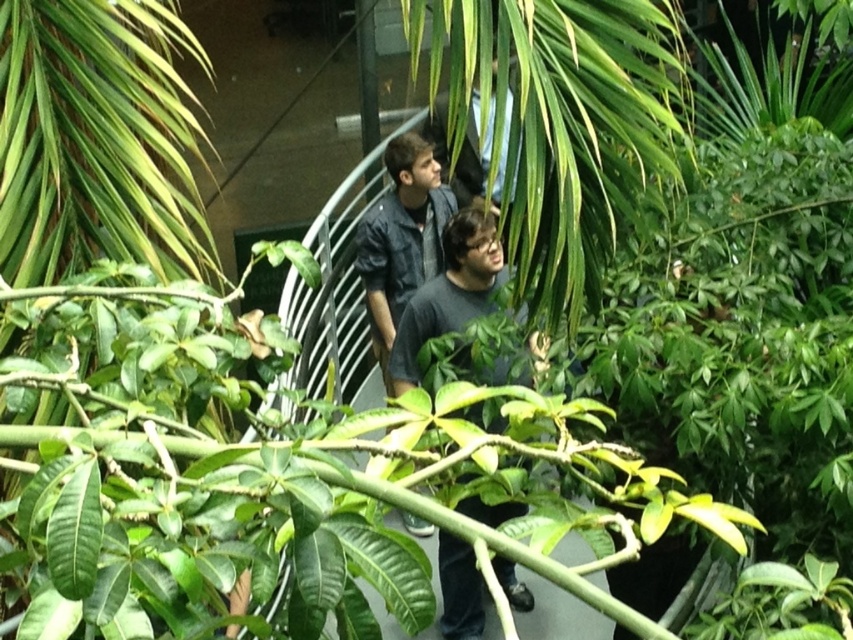
Describe the element at coordinates (450, 291) in the screenshot. The image size is (853, 640). I see `dark gray shirt at center` at that location.

Is dark gray shirt at center closer to camera compared to denim jacket at center?

Yes, it is in front of denim jacket at center.

Does point (450, 282) lie in front of point (401, 188)?

Yes, point (450, 282) is in front of point (401, 188).

The width and height of the screenshot is (853, 640). What are the coordinates of `dark gray shirt at center` in the screenshot? It's located at (450, 291).